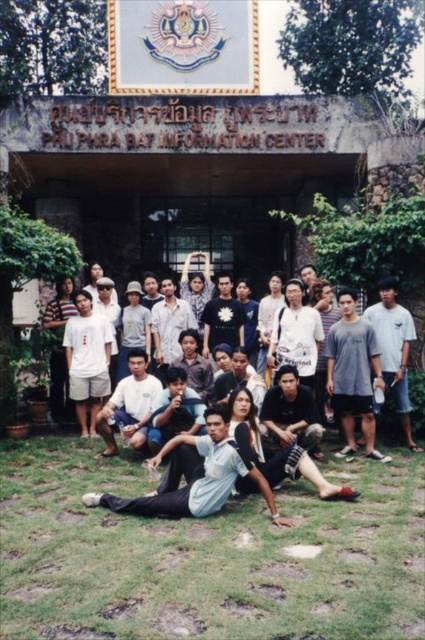
Question: Can you confirm if green grass at lower center is smaller than light blue fabric shirt at center?

Choices:
 (A) no
 (B) yes

Answer: (B)

Question: Considering the relative positions of green grass at lower center and light blue fabric shirt at center in the image provided, where is green grass at lower center located with respect to light blue fabric shirt at center?

Choices:
 (A) left
 (B) right

Answer: (A)

Question: Which of the following is the farthest from the observer?

Choices:
 (A) light blue fabric shirt at center
 (B) green grass at lower center

Answer: (A)

Question: Among these points, which one is nearest to the camera?

Choices:
 (A) (388, 456)
 (B) (401, 598)

Answer: (B)

Question: Does green grass at lower center appear under light blue fabric shirt at center?

Choices:
 (A) no
 (B) yes

Answer: (B)